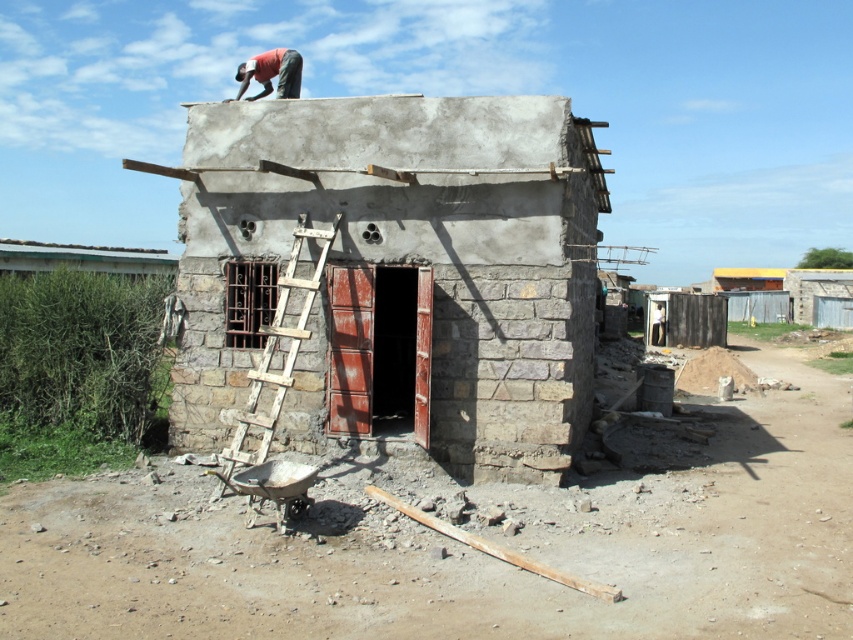
You are standing at the point labeled as point (276,349) in the image. What object are you touching?

The point (276,349) is on weathered wood ladder at center, so you are touching the weathered wood ladder at center.

You are standing in front of the smooth concrete hut at center and notice a matte red shirt at upper center. Which object is located higher in the image?

The matte red shirt at upper center is positioned higher than the smooth concrete hut at center.

You are a construction worker carrying a heavy tool box. You need to place it on the smooth concrete hut at center or the weathered wood ladder at center. Which object can you place the tool box on without it falling off?

The smooth concrete hut at center is smaller than the weathered wood ladder at center, so placing the tool box on the weathered wood ladder at center would be more stable and less likely to fall off.